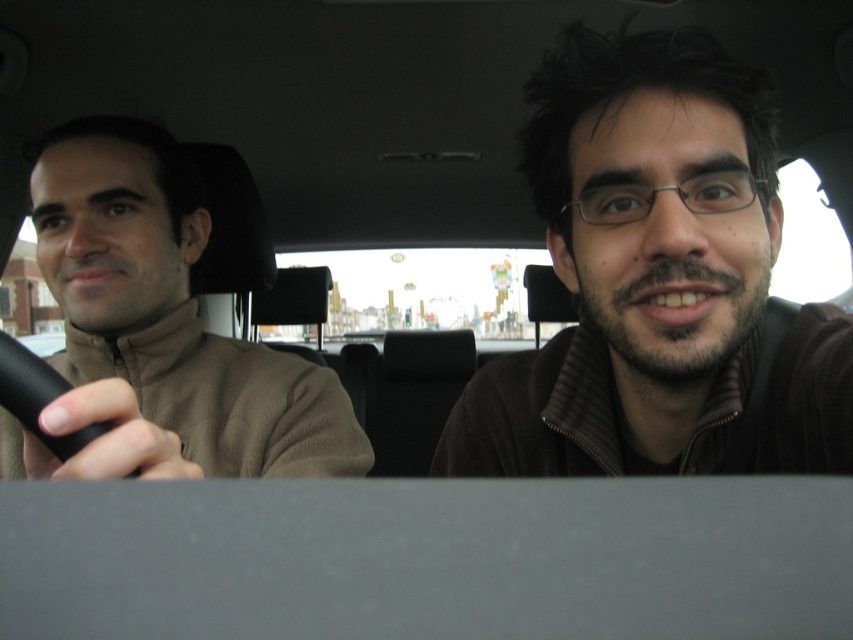
You are a tailor who needs to determine which item requires more fabric for a custom order. Based on the car scene, which object between the brown fuzzy sweater at upper right and the brown fleece at left would need more fabric?

The brown fleece at left requires more fabric because its width is greater than the brown fuzzy sweater at upper right.

You are a fashion designer observing the two people in the car. You need to determine which clothing item, the brown fuzzy sweater at upper right or the brown fleece at left, has a longer length based on their positions in the image. Can you figure it out?

The brown fuzzy sweater at upper right is much taller than the brown fleece at left, so the brown fuzzy sweater at upper right has a longer length.

From the picture: You are a fashion designer observing the two brown items in the car. Which item is smaller in size between the brown fuzzy sweater at upper right and the brown fleece at left?

The brown fuzzy sweater at upper right is smaller in size compared to the brown fleece at left.